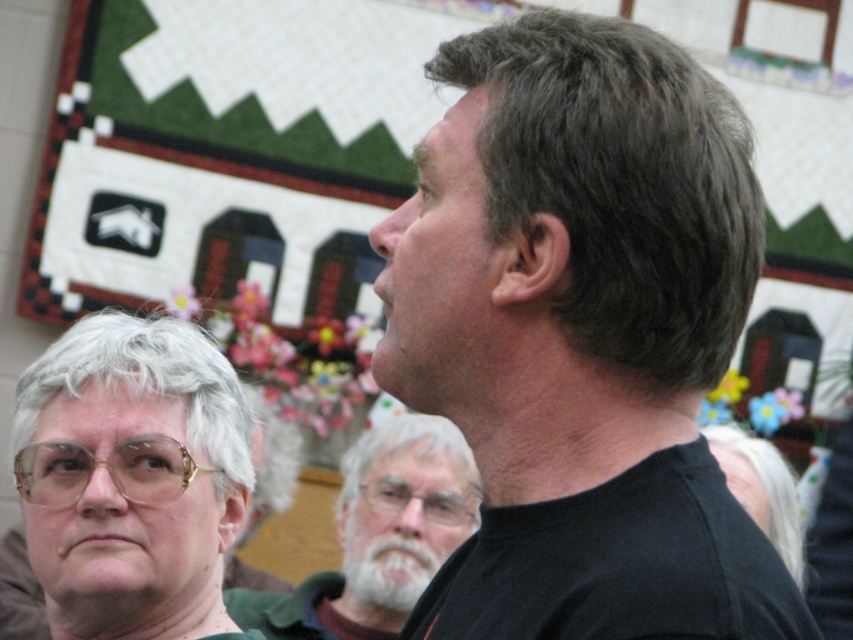
Question: Is gray hair at lower left wider than gray matte hair at center?

Choices:
 (A) yes
 (B) no

Answer: (B)

Question: Among these objects, which one is farthest from the camera?

Choices:
 (A) gray matte hair at center
 (B) dark gray textured hair at upper right
 (C) white matte hair at center
 (D) black matte shirt at upper right

Answer: (C)

Question: Among these points, which one is farthest from the camera?

Choices:
 (A) (248, 460)
 (B) (727, 470)
 (C) (662, 337)
 (D) (538, 556)

Answer: (B)

Question: Which object is the closest to the white beard at center?

Choices:
 (A) gray matte hair at center
 (B) gray hair at lower left

Answer: (A)

Question: Can you confirm if gray hair at lower left is smaller than white beard at center?

Choices:
 (A) no
 (B) yes

Answer: (B)

Question: Can you confirm if gray hair at lower left is positioned to the right of gray matte hair at center?

Choices:
 (A) yes
 (B) no

Answer: (B)